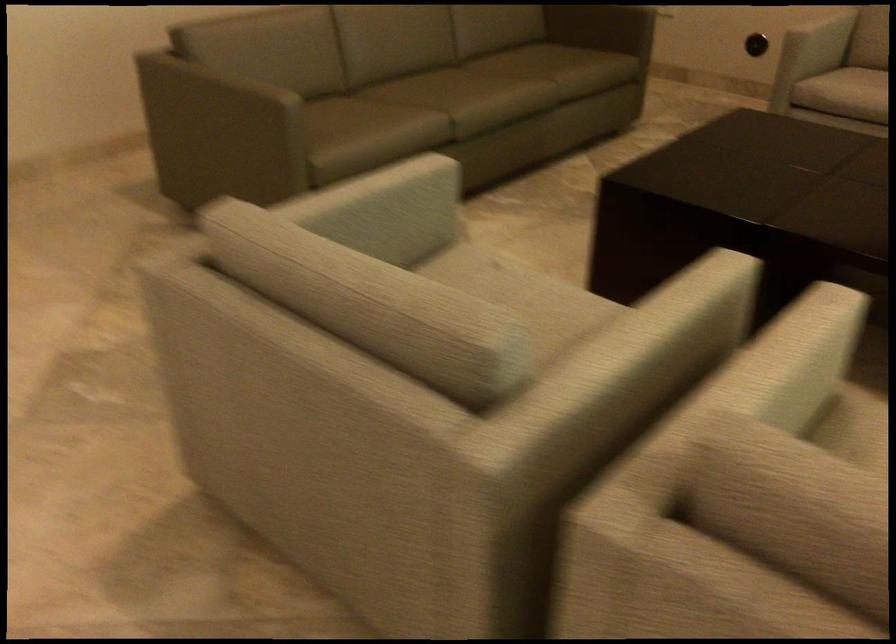
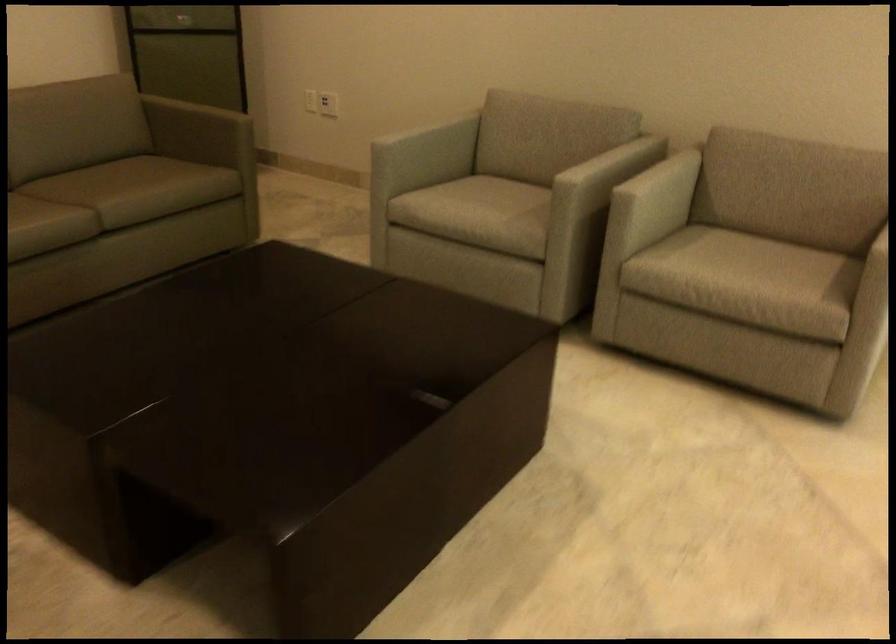
In a continuous first-person perspective shot, in which direction is the camera moving?

The cameraman walked toward right, forward.